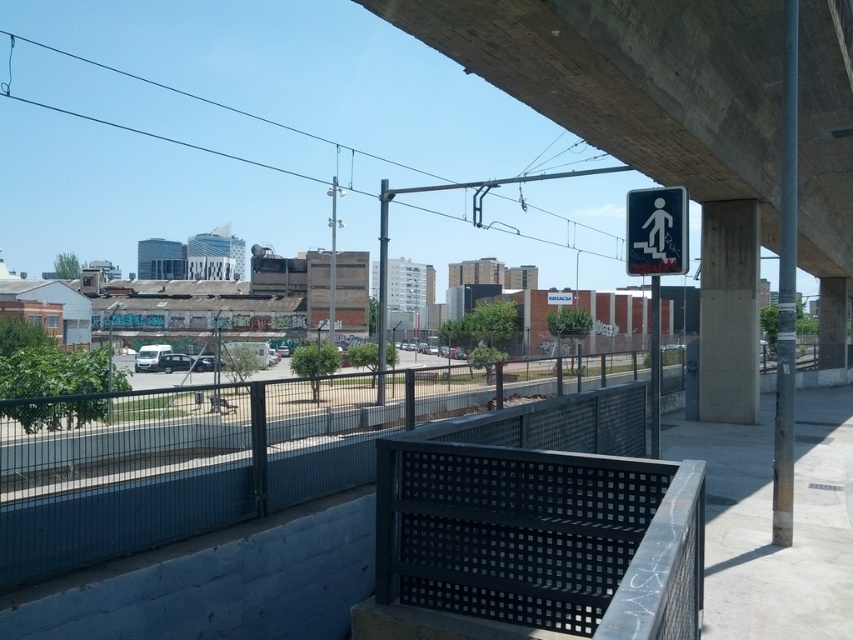
Question: Is concrete at upper right below black perforated metal bench at lower center?

Choices:
 (A) no
 (B) yes

Answer: (A)

Question: Which of the following is the farthest from the observer?

Choices:
 (A) white plastic pedestrian sign at upper center
 (B) black perforated metal bench at lower center

Answer: (A)

Question: Does black perforated metal bench at lower center have a greater width compared to white plastic pedestrian sign at upper center?

Choices:
 (A) no
 (B) yes

Answer: (A)

Question: Among these objects, which one is farthest from the camera?

Choices:
 (A) white plastic pedestrian sign at upper center
 (B) concrete at upper right
 (C) black perforated metal bench at lower center

Answer: (B)

Question: Based on their relative distances, which object is nearer to the black perforated metal bench at lower center?

Choices:
 (A) white plastic pedestrian sign at upper center
 (B) concrete at upper right

Answer: (A)

Question: Does concrete at upper right have a greater width compared to white plastic pedestrian sign at upper center?

Choices:
 (A) yes
 (B) no

Answer: (A)